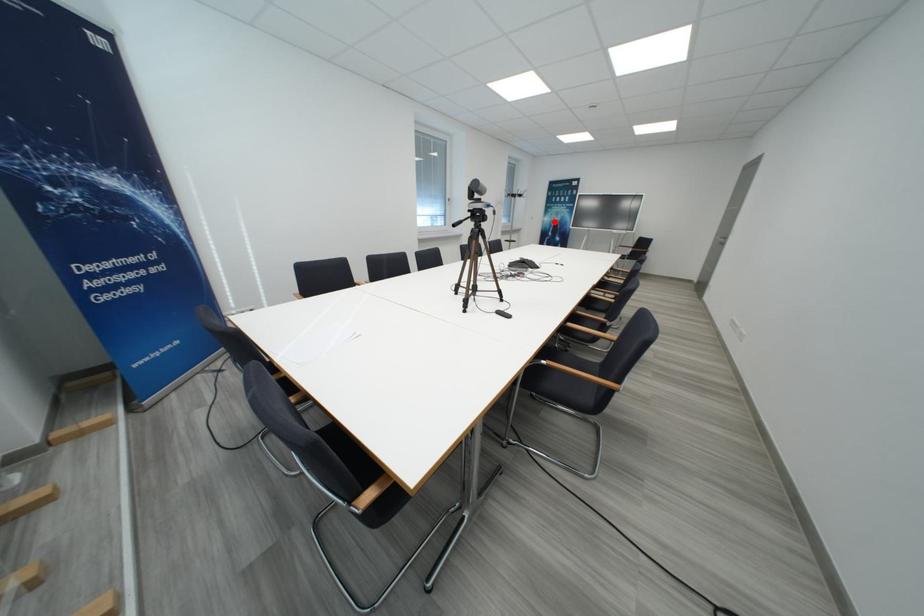
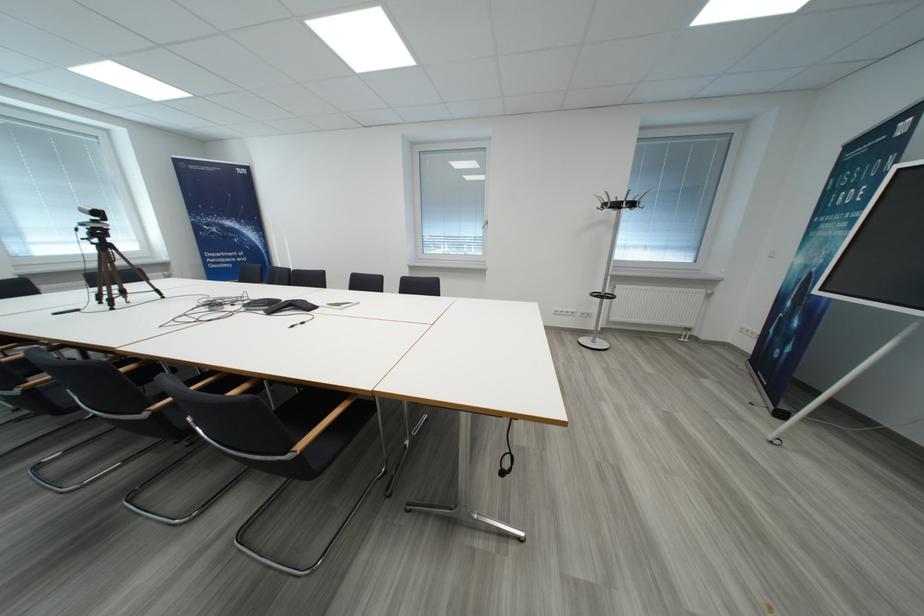
The point at the highlighted location is marked in the first image. Where is the corresponding point in the second image?

(807, 264)